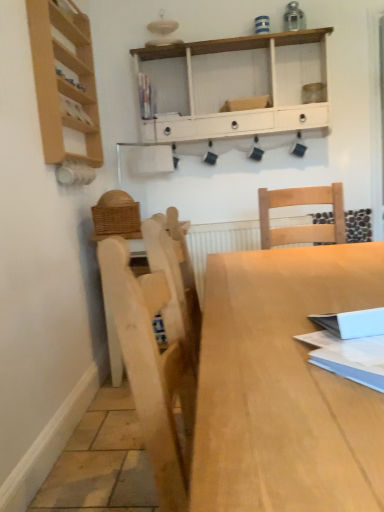
Question: Considering the positions of light wood shelf at left, the second shelf positioned from the right, and matte plastic book at upper center, which is the 2th book from bottom to top, in the image, is light wood shelf at left, the second shelf positioned from the right, wider or thinner than matte plastic book at upper center, which is the 2th book from bottom to top,?

Choices:
 (A) wide
 (B) thin

Answer: (A)

Question: Is light wood shelf at left, the second shelf positioned from the right, to the left or to the right of matte plastic book at upper center, which is counted as the second book, starting from the right, in the image?

Choices:
 (A) right
 (B) left

Answer: (B)

Question: Based on their relative distances, which object is farther from the light wood shelf at left, the second shelf positioned from the right?

Choices:
 (A) white painted wood shelf at upper center, which is the first shelf in right-to-left order
 (B) matte plastic book at upper center, which is the 2th book from bottom to top
 (C) light wood table at center
 (D) white paper book at right, the 1th book from the bottom

Answer: (D)

Question: Considering the real-world distances, which object is closest to the light wood table at center?

Choices:
 (A) light wood shelf at left, which appears as the first shelf when viewed from the left
 (B) matte plastic book at upper center, marked as the 1th book in a back-to-front arrangement
 (C) white paper book at right, the 1th book from the bottom
 (D) white painted wood shelf at upper center, marked as the second shelf in a front-to-back arrangement

Answer: (C)